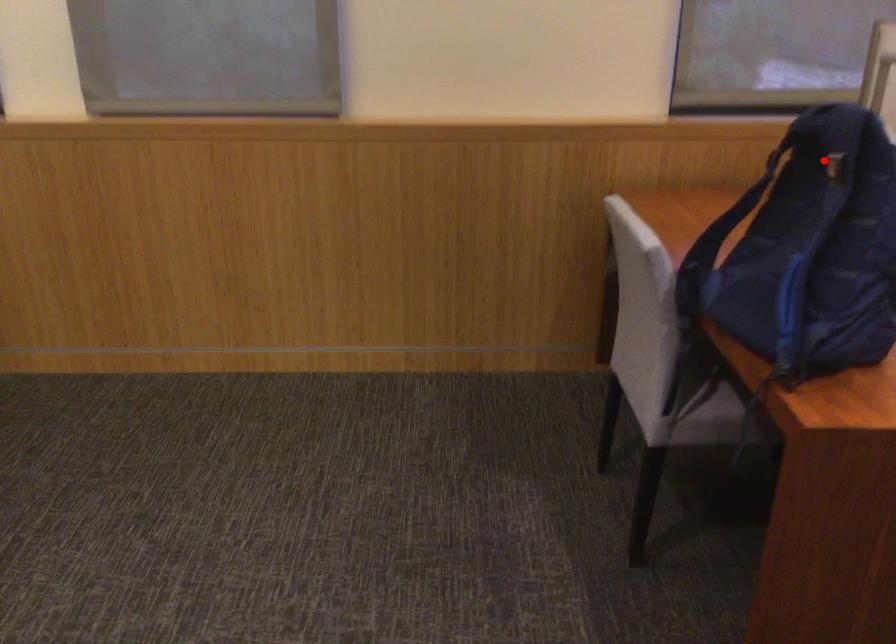
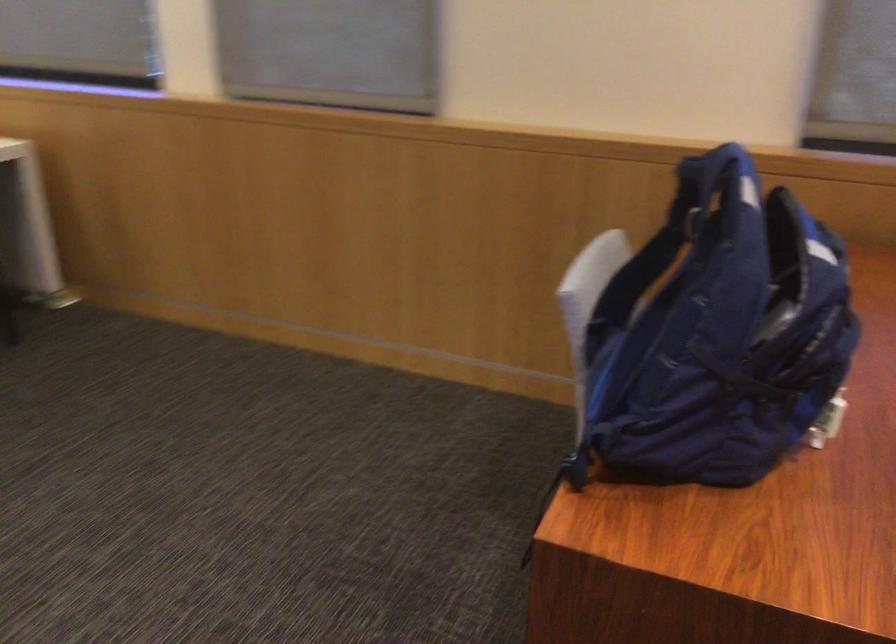
Question: I am providing you with two images of the same scene from different viewpoints. Image1 has a red point marked. In image2, the corresponding 3D location appears at what relative position? Reply with the corresponding letter.

Choices:
 (A) Closer
 (B) Farther

Answer: (A)